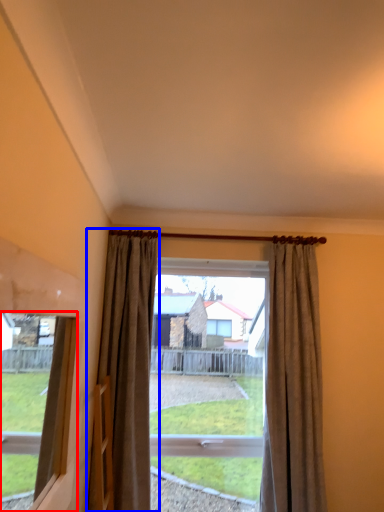
Question: Which object appears farthest to the camera in this image, window (highlighted by a red box) or curtain (highlighted by a blue box)?

Choices:
 (A) window
 (B) curtain

Answer: (B)